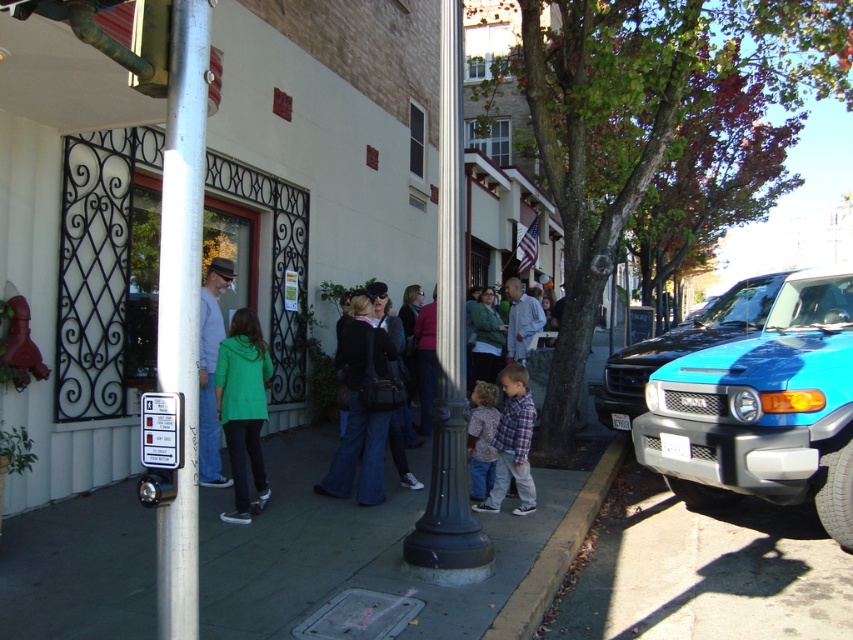
You are a delivery person trying to place a heavy box on the gray concrete sidewalk at center. However, there is a green matte jacket at center in the way. Can you place the box there without moving the jacket?

The gray concrete sidewalk at center is positioned under the green matte jacket at center, so the jacket is above the sidewalk. Since the jacket is above, you cannot place the box there without moving the jacket.

Looking at this image, you are a photographer trying to capture a photo of both the denim jacket at center and the plaid shirt at center in the same frame. Based on their positions, which one should you focus on first to ensure both are in the shot?

The denim jacket at center is taller than the plaid shirt at center, so you should focus on the denim jacket at center first to ensure both are in the shot.